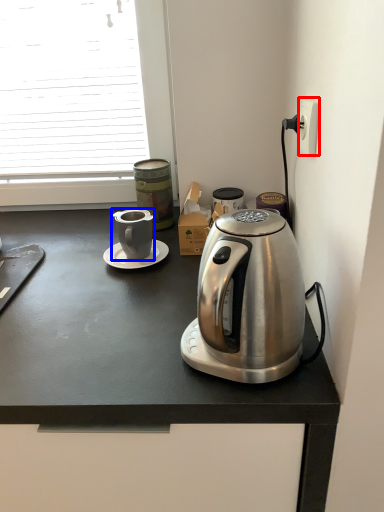
Question: Which object is further to the camera taking this photo, power outlet (highlighted by a red box) or coffee cup (highlighted by a blue box)?

Choices:
 (A) power outlet
 (B) coffee cup

Answer: (B)